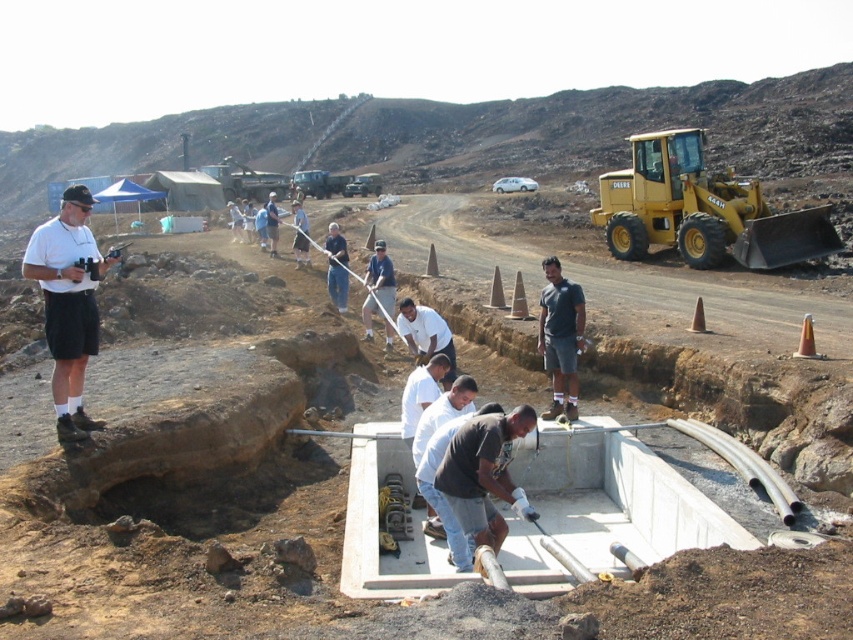
Consider the image. Can you confirm if yellow rubber tractor at upper right is smaller than dark gray t-shirt at center?

Incorrect, yellow rubber tractor at upper right is not smaller in size than dark gray t-shirt at center.

Is yellow rubber tractor at upper right to the left of dark gray t-shirt at center from the viewer's perspective?

Incorrect, yellow rubber tractor at upper right is not on the left side of dark gray t-shirt at center.

Between point (630, 237) and point (560, 378), which one is positioned behind?

The point (630, 237) is more distant.

Locate an element on the screen. The width and height of the screenshot is (853, 640). yellow rubber tractor at upper right is located at coordinates [701, 209].

Does white concrete foundation at center have a smaller size compared to dark gray t-shirt at center?

No, white concrete foundation at center is not smaller than dark gray t-shirt at center.

In the scene shown: Does white concrete foundation at center appear under dark gray t-shirt at center?

Yes.

Does point (508, 563) come behind point (570, 301)?

No, (508, 563) is closer to viewer.

Identify the location of white concrete foundation at center. The width and height of the screenshot is (853, 640). (618, 499).

Which is behind, point (102, 262) or point (550, 282)?

The point (550, 282) is behind.

Measure the distance between white matte shirt at upper left and camera.

The distance of white matte shirt at upper left from camera is 6.79 meters.

The width and height of the screenshot is (853, 640). What are the coordinates of `white matte shirt at upper left` in the screenshot? It's located at click(x=68, y=304).